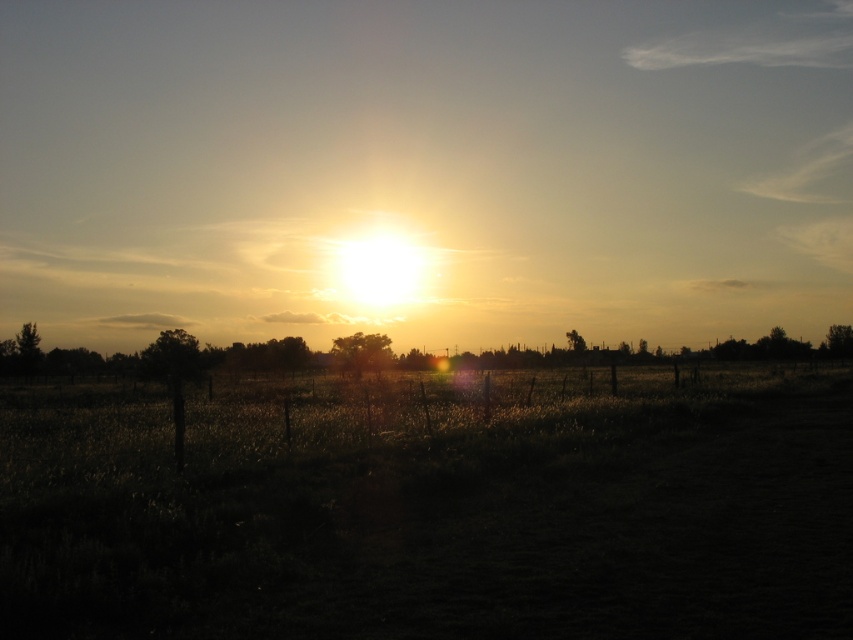
You are standing in the middle of the field and looking straight ahead. Which object, the golden sky at center or the dark grass at center, appears taller from your perspective?

The golden sky at center appears taller than the dark grass at center because it has a greater height compared to the dark grass at center according to the description.